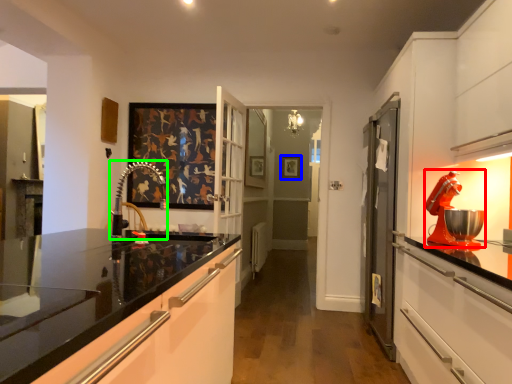
Question: Based on their relative distances, which object is nearer to home appliance (highlighted by a red box)? Choose from picture frame (highlighted by a blue box) and faucet (highlighted by a green box).

Choices:
 (A) picture frame
 (B) faucet

Answer: (B)